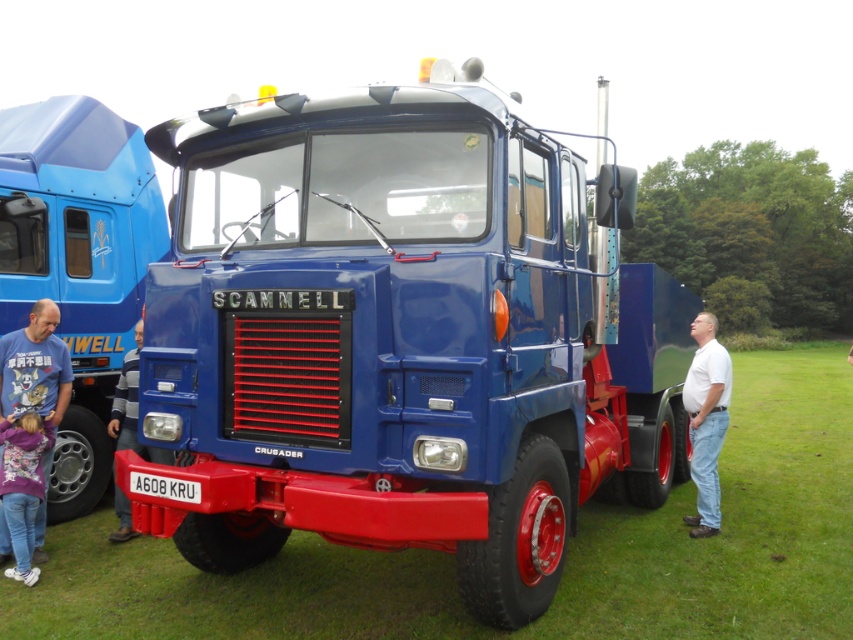
You are a photographer trying to capture the glossy blue truck at center and the floral hoodie at lower left in the same frame. Based on their sizes, which object should you focus on to ensure both fit in the photo?

The glossy blue truck at center is wider than the floral hoodie at lower left, so you should focus on the glossy blue truck at center to ensure both objects fit in the frame.

You are a photographer at the event and want to capture both the matte blue truck at center and the white cotton shirt at center in a single photo. Since the truck is blocking the shirt, how can you adjust your position to ensure both are visible?

Since the matte blue truck at center is positioned over the white cotton shirt at center, you can move your camera position lower to capture both objects in the frame. By lowering the camera angle, you can see beneath the truck to include the shirt in the photo.